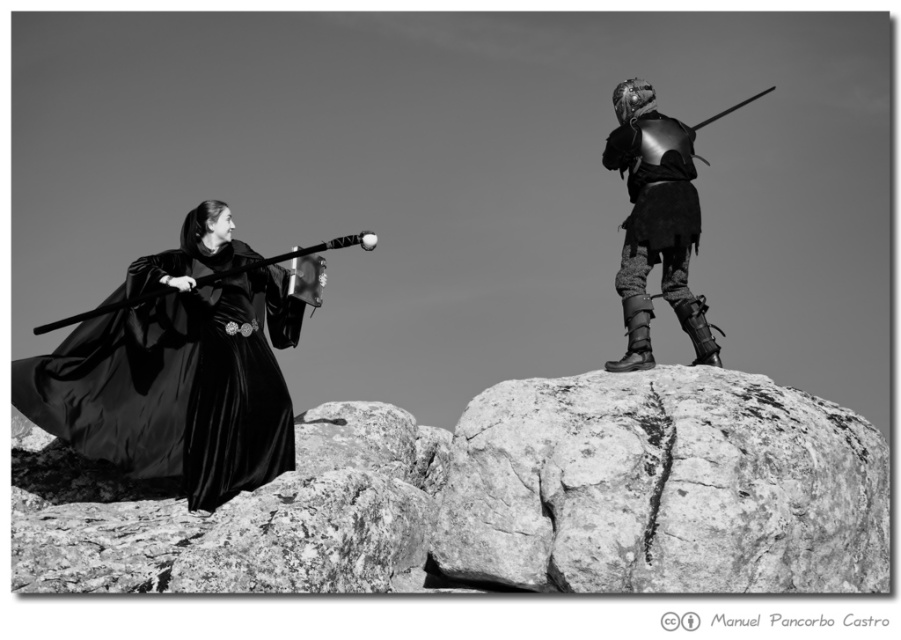
Question: Does rough textured rock at center have a larger size compared to velvet black robe at left?

Choices:
 (A) no
 (B) yes

Answer: (A)

Question: Among these objects, which one is nearest to the camera?

Choices:
 (A) rough textured rock at center
 (B) velvet black robe at left

Answer: (A)

Question: Does rough textured rock at center have a greater width compared to velvet black robe at left?

Choices:
 (A) yes
 (B) no

Answer: (A)

Question: Does rough textured rock at center appear over velvet black robe at left?

Choices:
 (A) yes
 (B) no

Answer: (B)